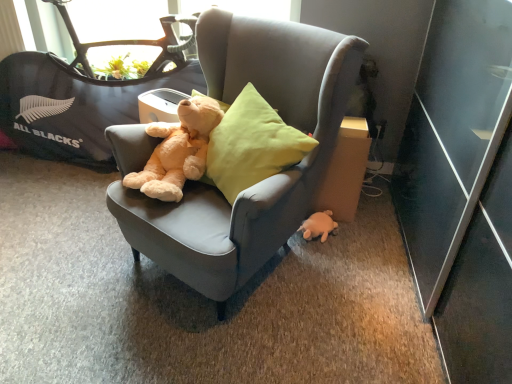
At what (x,y) coordinates should I click in order to perform the action: click on free space in front of cardboard at right. Please return your answer as a coordinate pair (x, y). This screenshot has height=384, width=512. Looking at the image, I should click on (352, 238).